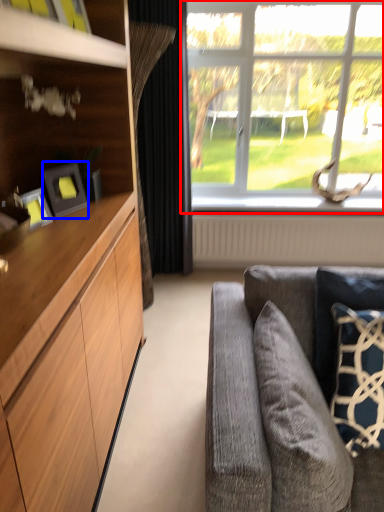
Question: Which point is closer to the camera, window (highlighted by a red box) or picture frame (highlighted by a blue box)?

Choices:
 (A) window
 (B) picture frame

Answer: (B)